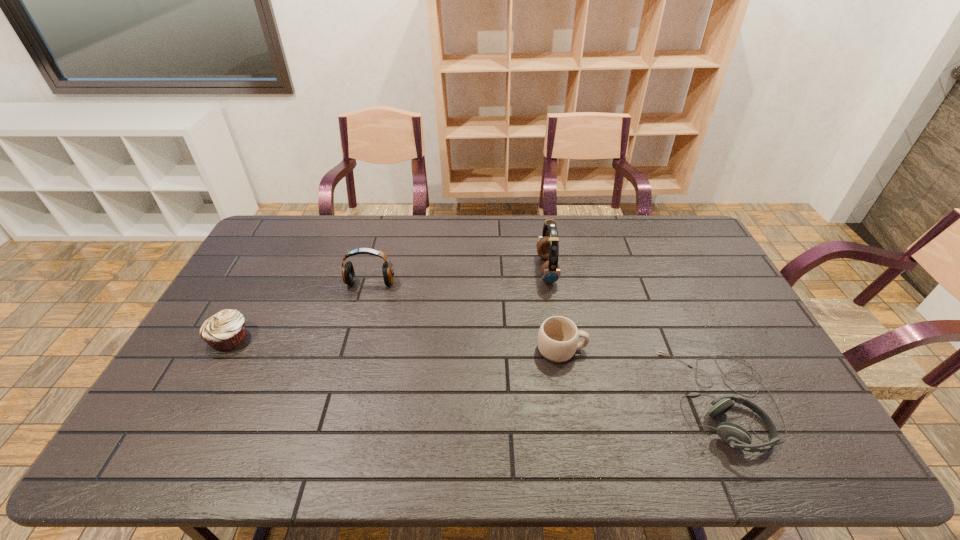
At what (x,y) coordinates should I click in order to perform the action: click on the tallest object. Please return your answer as a coordinate pair (x, y). This screenshot has width=960, height=540. Looking at the image, I should click on (548, 244).

Where is `the tallest headset`? The width and height of the screenshot is (960, 540). the tallest headset is located at coordinates (548, 244).

Where is `the second object from left to right`? the second object from left to right is located at coordinates (348, 274).

In order to click on the second tallest headset in this screenshot , I will do `click(348, 274)`.

This screenshot has height=540, width=960. In order to click on muffin in this screenshot , I will do `click(225, 330)`.

In order to click on mug in this screenshot , I will do `click(558, 336)`.

You are a GUI agent. You are given a task and a screenshot of the screen. Output one action in this format:
    pyautogui.click(x=<x>, y=<y>)
    Task: Click on the shortest headset
    
    Given the screenshot: What is the action you would take?
    pyautogui.click(x=737, y=437)

Locate an element on the screen. the nearest headset is located at coordinates (737, 437).

This screenshot has width=960, height=540. What are the coordinates of `free space located 0.170m on the ear cup of the tallest headset` in the screenshot? It's located at point(489,270).

Locate an element on the screen. The image size is (960, 540). vacant region located on the ear cup of the tallest headset is located at coordinates (497, 270).